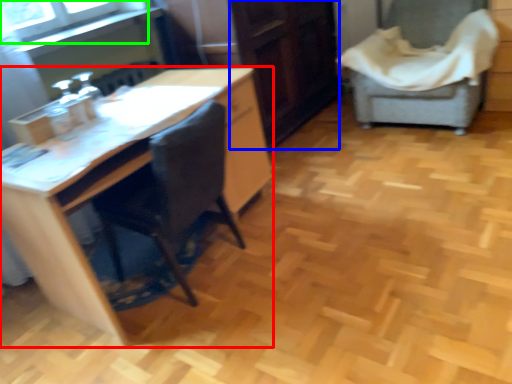
Question: Based on their relative distances, which object is farther from desk (highlighted by a red box)? Choose from file cabinet (highlighted by a blue box) and window screen (highlighted by a green box).

Choices:
 (A) file cabinet
 (B) window screen

Answer: (A)